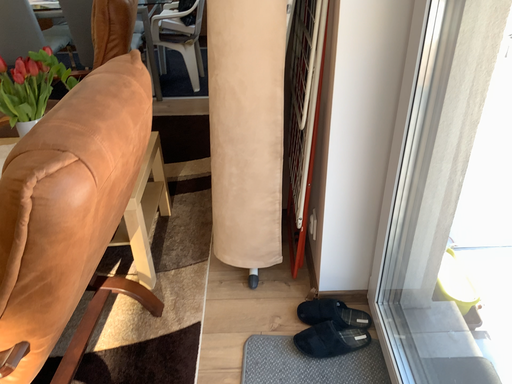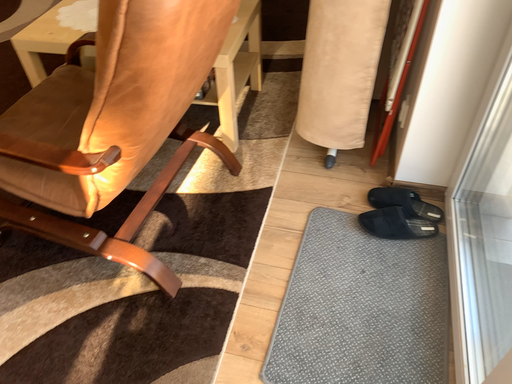
Question: How did the camera likely rotate when shooting the video?

Choices:
 (A) rotated right
 (B) rotated left

Answer: (B)